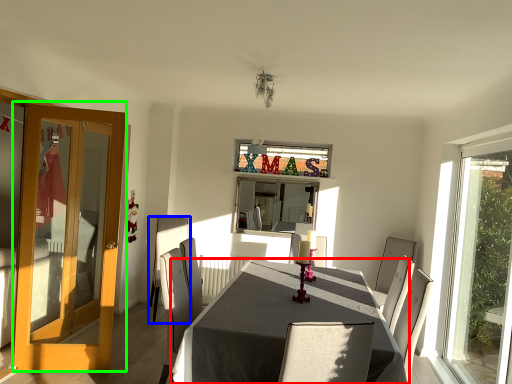
Question: Considering the real-world distances, which object is closest to table (highlighted by a red box)? chair (highlighted by a blue box) or door (highlighted by a green box).

Choices:
 (A) chair
 (B) door

Answer: (B)